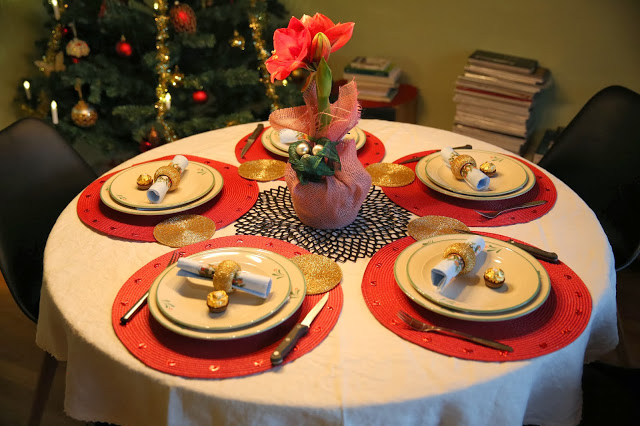
Find the location of `utensils`. utensils is located at coordinates (413, 159), (314, 314), (131, 310), (451, 331), (525, 245), (516, 206), (246, 142).